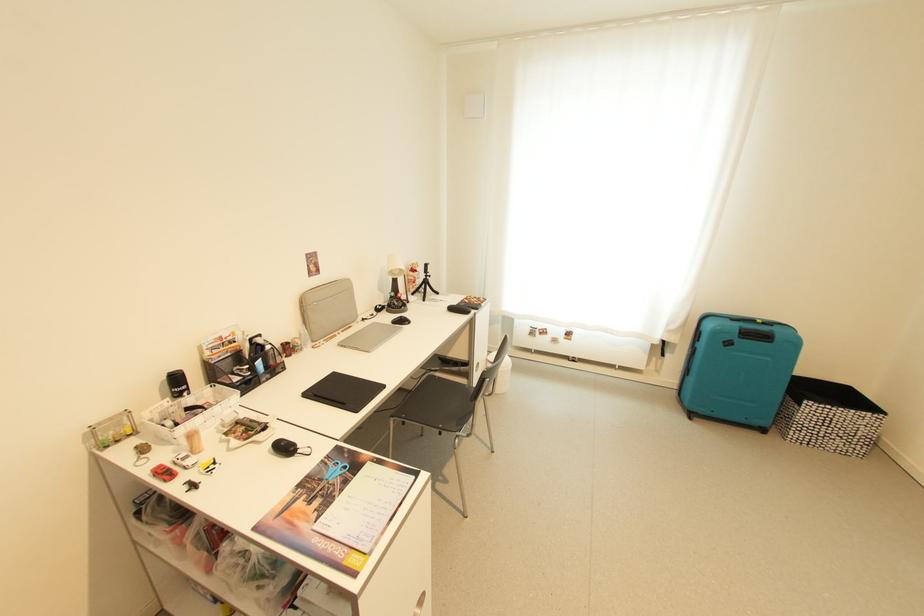
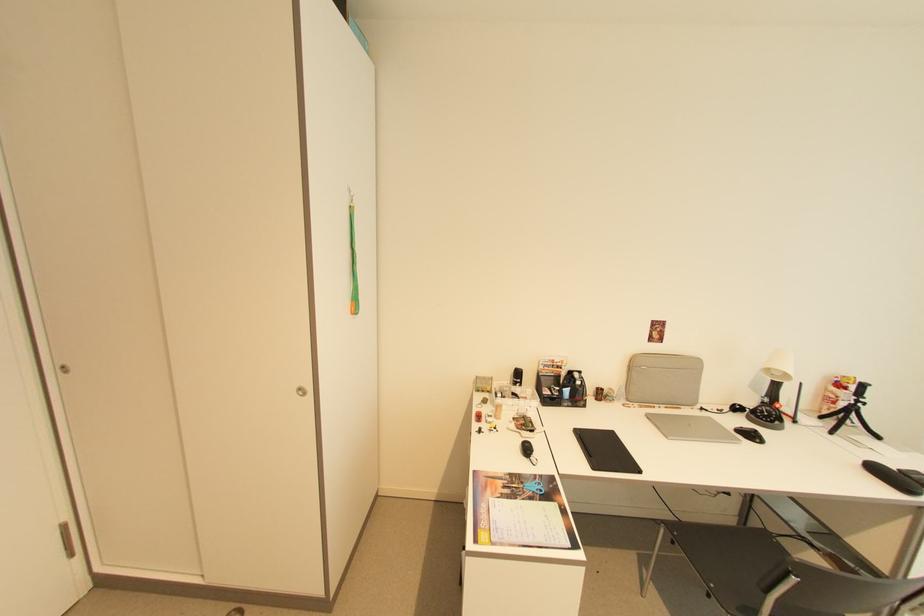
Where in the second image is the point corresponding to (x=430, y=278) from the first image?

(857, 405)